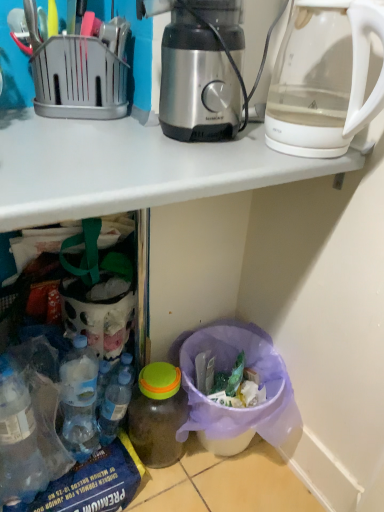
Describe the element at coordinates (324, 78) in the screenshot. I see `transparent glass kettle at upper right` at that location.

The image size is (384, 512). Identify the location of translucent plastic bottle at lower center, marked as the first bottle in a right-to-left arrangement. (157, 414).

What is the approximate height of translucent plastic bottle at lower center, marked as the first bottle in a right-to-left arrangement?

It is 10.31 inches.

You are a GUI agent. You are given a task and a screenshot of the screen. Output one action in this format:
    pyautogui.click(x=<x>, y=<y>)
    Task: Click on the stainless steel coffee maker at center
    
    Given the screenshot: What is the action you would take?
    pyautogui.click(x=202, y=71)

This screenshot has height=512, width=384. Find the location of `transparent glass kettle at upper right`. transparent glass kettle at upper right is located at coordinates (324, 78).

Can you see transparent glass kettle at upper right touching stainless steel coffee maker at center?

No, transparent glass kettle at upper right is not beside stainless steel coffee maker at center.

From the image's perspective, which object appears higher, transparent glass kettle at upper right or stainless steel coffee maker at center?

From the image's view, stainless steel coffee maker at center is above.

Between transparent glass kettle at upper right and stainless steel coffee maker at center, which one has less height?

With less height is stainless steel coffee maker at center.

Based on the photo, is transparent glass kettle at upper right wider than stainless steel coffee maker at center?

Yes.

Which is more to the left, transparent glass kettle at upper right or blue translucent bottle at lower left, the second bottle positioned from the right?

blue translucent bottle at lower left, the second bottle positioned from the right.

Is transparent glass kettle at upper right placed right next to blue translucent bottle at lower left, the 1th bottle from the left?

transparent glass kettle at upper right and blue translucent bottle at lower left, the 1th bottle from the left, are clearly separated.

Looking at this image, is blue translucent bottle at lower left, the second bottle positioned from the right, surrounded by transparent glass kettle at upper right?

No.

Is transparent glass kettle at upper right oriented away from blue translucent bottle at lower left, the 1th bottle from the left?

No, transparent glass kettle at upper right is not facing the opposite direction of blue translucent bottle at lower left, the 1th bottle from the left.

Is translucent plastic bottle at lower center, marked as the first bottle in a right-to-left arrangement, oriented away from blue translucent bottle at lower left, the 1th bottle from the left?

No, translucent plastic bottle at lower center, marked as the first bottle in a right-to-left arrangement, is not facing away from blue translucent bottle at lower left, the 1th bottle from the left.

Between translucent plastic bottle at lower center, the second bottle when ordered from left to right, and blue translucent bottle at lower left, the 1th bottle from the left, which one has larger width?

translucent plastic bottle at lower center, the second bottle when ordered from left to right, is wider.

Is translucent plastic bottle at lower center, the second bottle when ordered from left to right, shorter than blue translucent bottle at lower left, the 1th bottle from the left?

In fact, translucent plastic bottle at lower center, the second bottle when ordered from left to right, may be taller than blue translucent bottle at lower left, the 1th bottle from the left.

Between blue translucent bottle at lower left, the second bottle positioned from the right, and translucent plastic bottle at lower center, the second bottle when ordered from left to right, which one appears on the left side from the viewer's perspective?

blue translucent bottle at lower left, the second bottle positioned from the right.

Where is `bottle that appears on the right of blue translucent bottle at lower left, the 1th bottle from the left`? This screenshot has height=512, width=384. bottle that appears on the right of blue translucent bottle at lower left, the 1th bottle from the left is located at coordinates point(157,414).

Between blue translucent bottle at lower left, the 1th bottle from the left, and translucent plastic bottle at lower center, marked as the first bottle in a right-to-left arrangement, which one has more height?

With more height is translucent plastic bottle at lower center, marked as the first bottle in a right-to-left arrangement.

Which is more distant, (101, 415) or (140, 432)?

Positioned behind is point (101, 415).

What's the angular difference between stainless steel coffee maker at center and blue translucent bottle at lower left, the 1th bottle from the left,'s facing directions?

The facing directions of stainless steel coffee maker at center and blue translucent bottle at lower left, the 1th bottle from the left, are 0.00134 degrees apart.

Between stainless steel coffee maker at center and blue translucent bottle at lower left, the second bottle positioned from the right, which one appears on the right side from the viewer's perspective?

From the viewer's perspective, stainless steel coffee maker at center appears more on the right side.

Is stainless steel coffee maker at center smaller than blue translucent bottle at lower left, the 1th bottle from the left?

No, stainless steel coffee maker at center is not smaller than blue translucent bottle at lower left, the 1th bottle from the left.

Is stainless steel coffee maker at center outside of transparent glass kettle at upper right?

That's correct, stainless steel coffee maker at center is outside of transparent glass kettle at upper right.

Does stainless steel coffee maker at center have a smaller size compared to transparent glass kettle at upper right?

No, stainless steel coffee maker at center is not smaller than transparent glass kettle at upper right.

Is point (174, 42) behind point (317, 36)?

That is False.

Is translucent plastic bottle at lower center, marked as the first bottle in a right-to-left arrangement, to the right of stainless steel coffee maker at center from the viewer's perspective?

In fact, translucent plastic bottle at lower center, marked as the first bottle in a right-to-left arrangement, is to the left of stainless steel coffee maker at center.

Which object is further away from the camera taking this photo, translucent plastic bottle at lower center, marked as the first bottle in a right-to-left arrangement, or stainless steel coffee maker at center?

translucent plastic bottle at lower center, marked as the first bottle in a right-to-left arrangement.

The height and width of the screenshot is (512, 384). What are the coordinates of `coffee maker on the right of the translucent plastic bottle at lower center, the second bottle when ordered from left to right` in the screenshot? It's located at click(202, 71).

Can you confirm if translucent plastic bottle at lower center, the second bottle when ordered from left to right, is taller than stainless steel coffee maker at center?

Indeed, translucent plastic bottle at lower center, the second bottle when ordered from left to right, has a greater height compared to stainless steel coffee maker at center.

Where is `coffee maker above the transparent glass kettle at upper right (from the image's perspective)`? The image size is (384, 512). coffee maker above the transparent glass kettle at upper right (from the image's perspective) is located at coordinates (202, 71).

From a real-world perspective, count 1st bottles downward from the transparent glass kettle at upper right and point to it. Please provide its 2D coordinates.

[(114, 406)]

Consider the image. Which object lies further to the anchor point blue translucent bottle at lower left, the second bottle positioned from the right, translucent plastic bottle at lower center, the second bottle when ordered from left to right, or transparent glass kettle at upper right?

transparent glass kettle at upper right is further to blue translucent bottle at lower left, the second bottle positioned from the right.

Estimate the real-world distances between objects in this image. Which object is closer to translucent plastic bottle at lower center, marked as the first bottle in a right-to-left arrangement, blue translucent bottle at lower left, the 1th bottle from the left, or transparent glass kettle at upper right?

The object closer to translucent plastic bottle at lower center, marked as the first bottle in a right-to-left arrangement, is blue translucent bottle at lower left, the 1th bottle from the left.

Looking at the image, which one is located further to transparent glass kettle at upper right, blue translucent bottle at lower left, the 1th bottle from the left, or stainless steel coffee maker at center?

blue translucent bottle at lower left, the 1th bottle from the left, is positioned further to the anchor transparent glass kettle at upper right.

Looking at this image, from the image, which object appears to be farther from translucent plastic bottle at lower center, marked as the first bottle in a right-to-left arrangement, stainless steel coffee maker at center or blue translucent bottle at lower left, the second bottle positioned from the right?

The object further to translucent plastic bottle at lower center, marked as the first bottle in a right-to-left arrangement, is stainless steel coffee maker at center.

When comparing their distances from blue translucent bottle at lower left, the second bottle positioned from the right, does transparent glass kettle at upper right or stainless steel coffee maker at center seem further?

Among the two, transparent glass kettle at upper right is located further to blue translucent bottle at lower left, the second bottle positioned from the right.

Based on the photo, which object lies further to the anchor point translucent plastic bottle at lower center, the second bottle when ordered from left to right, transparent glass kettle at upper right or blue translucent bottle at lower left, the 1th bottle from the left?

transparent glass kettle at upper right.

Looking at the image, which one is located further to transparent glass kettle at upper right, blue translucent bottle at lower left, the second bottle positioned from the right, or translucent plastic bottle at lower center, the second bottle when ordered from left to right?

Among the two, blue translucent bottle at lower left, the second bottle positioned from the right, is located further to transparent glass kettle at upper right.

Considering their positions, is blue translucent bottle at lower left, the second bottle positioned from the right, positioned closer to translucent plastic bottle at lower center, marked as the first bottle in a right-to-left arrangement, than stainless steel coffee maker at center?

blue translucent bottle at lower left, the second bottle positioned from the right.

Locate an element on the screen. This screenshot has height=512, width=384. kettle between stainless steel coffee maker at center and translucent plastic bottle at lower center, marked as the first bottle in a right-to-left arrangement, in the up-down direction is located at coordinates (324, 78).

This screenshot has height=512, width=384. Find the location of `kettle that lies between stainless steel coffee maker at center and blue translucent bottle at lower left, the second bottle positioned from the right, from top to bottom`. kettle that lies between stainless steel coffee maker at center and blue translucent bottle at lower left, the second bottle positioned from the right, from top to bottom is located at coordinates (324, 78).

I want to click on bottle between stainless steel coffee maker at center and translucent plastic bottle at lower center, marked as the first bottle in a right-to-left arrangement, from top to bottom, so click(x=114, y=406).

Where is `bottle between transparent glass kettle at upper right and translucent plastic bottle at lower center, marked as the first bottle in a right-to-left arrangement, vertically`? This screenshot has height=512, width=384. bottle between transparent glass kettle at upper right and translucent plastic bottle at lower center, marked as the first bottle in a right-to-left arrangement, vertically is located at coordinates (114, 406).